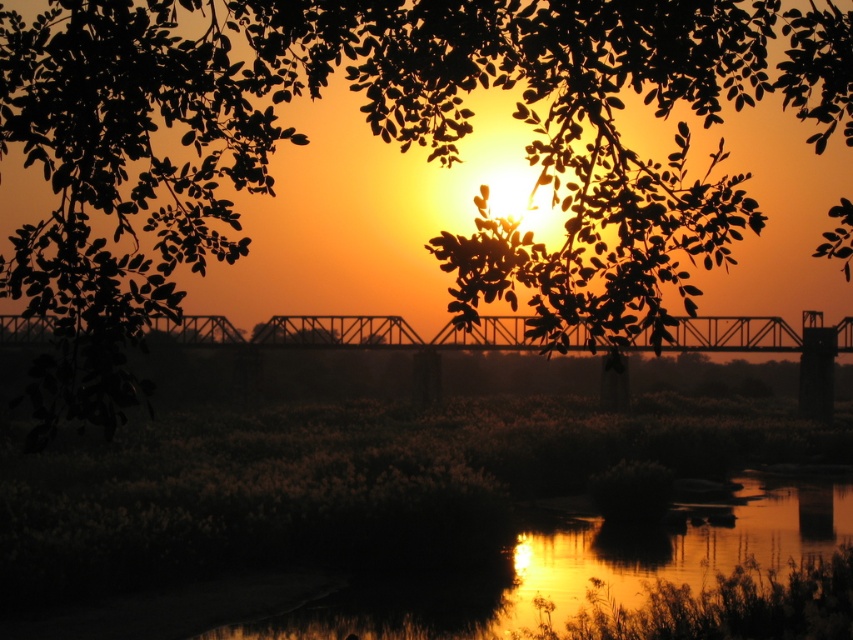
Question: Which of these objects is positioned closest to the shiny reflective water at center?

Choices:
 (A) green leafy tree at upper center
 (B) metallic bridge at center

Answer: (A)

Question: Is green leafy tree at upper center above shiny reflective water at center?

Choices:
 (A) no
 (B) yes

Answer: (B)

Question: Does green leafy tree at upper center lie in front of metallic bridge at center?

Choices:
 (A) no
 (B) yes

Answer: (B)

Question: Which of the following is the closest to the observer?

Choices:
 (A) metallic bridge at center
 (B) green leafy tree at upper center

Answer: (B)

Question: Which object is the farthest from the green leafy tree at upper center?

Choices:
 (A) shiny reflective water at center
 (B) metallic bridge at center

Answer: (A)

Question: Is shiny reflective water at center positioned before metallic bridge at center?

Choices:
 (A) yes
 (B) no

Answer: (B)